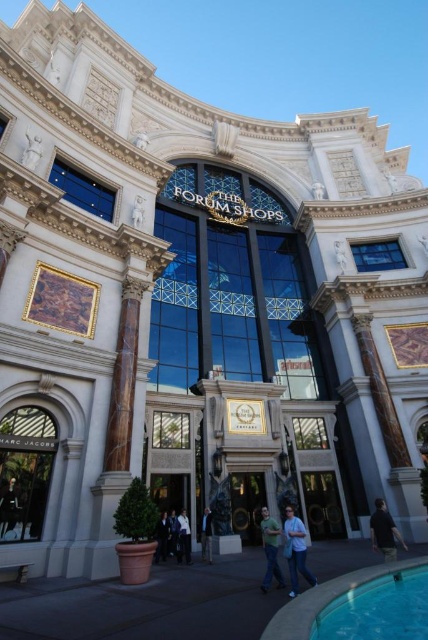
You are standing at the entrance of The Forum Shops in Las Vegas. You see a point marked at coordinates [115,438]. What object is located at that point?

The point at coordinates [115,438] corresponds to the marble column at left.

Consider the image. You are a tour guide leading a group to the entrance of The Forum Shops. You want to point out both the marble column at left and the dark blue jeans at center to your group. Can you do so without moving your position? Explain why or why not.

The marble column at left and the dark blue jeans at center are 12.31 meters apart. Since the distance between them is quite large, you can point to both objects from your current position as long as they are within your line of sight and the group can see them.